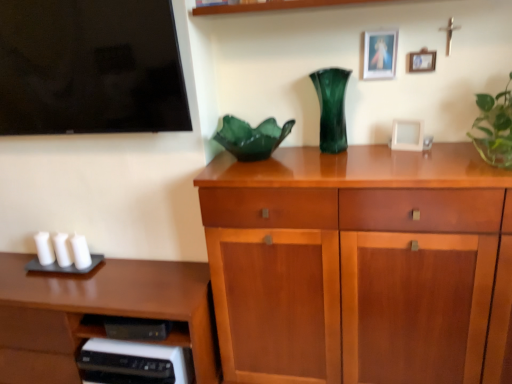
Question: Is matte gold picture frame at upper right, the first picture frame from the top, bigger than wooden cabinet at center?

Choices:
 (A) yes
 (B) no

Answer: (B)

Question: From a real-world perspective, is matte gold picture frame at upper right, the first picture frame from the top, physically above wooden cabinet at center?

Choices:
 (A) no
 (B) yes

Answer: (B)

Question: Is matte gold picture frame at upper right, the 3th picture frame ordered from the bottom, not inside wooden cabinet at center?

Choices:
 (A) no
 (B) yes

Answer: (B)

Question: Is matte gold picture frame at upper right, the first picture frame from the top, positioned with its back to wooden cabinet at center?

Choices:
 (A) yes
 (B) no

Answer: (B)

Question: Is matte gold picture frame at upper right, the first picture frame from the top, smaller than wooden cabinet at center?

Choices:
 (A) yes
 (B) no

Answer: (A)

Question: Is matte white picture frame at upper right, the 2th picture frame positioned from the bottom, bigger or smaller than green glass vase at center?

Choices:
 (A) small
 (B) big

Answer: (A)

Question: Is matte white picture frame at upper right, the 2th picture frame positioned from the bottom, inside or outside of green glass vase at center?

Choices:
 (A) outside
 (B) inside

Answer: (A)

Question: From a real-world perspective, relative to green glass vase at center, is matte white picture frame at upper right, arranged as the 2th picture frame when viewed from the top, vertically above or below?

Choices:
 (A) below
 (B) above

Answer: (B)

Question: Considering the positions of point (417, 59) and point (344, 119), is point (417, 59) closer or farther from the camera than point (344, 119)?

Choices:
 (A) closer
 (B) farther

Answer: (A)

Question: Is white matte candle at lower left, the 3th candle in the right-to-left sequence, in front of or behind wooden cabinet at center in the image?

Choices:
 (A) behind
 (B) front

Answer: (A)

Question: From the image's perspective, is white matte candle at lower left, which appears as the first candle when viewed from the left, positioned above or below wooden cabinet at center?

Choices:
 (A) below
 (B) above

Answer: (B)

Question: In terms of width, does white matte candle at lower left, the 3th candle in the right-to-left sequence, look wider or thinner when compared to wooden cabinet at center?

Choices:
 (A) thin
 (B) wide

Answer: (A)

Question: In terms of size, does white matte candle at lower left, which appears as the first candle when viewed from the left, appear bigger or smaller than wooden cabinet at center?

Choices:
 (A) small
 (B) big

Answer: (A)

Question: Do you think matte gold picture frame at upper right, the first picture frame from the top, is within green glass vase at center, or outside of it?

Choices:
 (A) outside
 (B) inside

Answer: (A)

Question: In terms of height, does matte gold picture frame at upper right, the first picture frame from the top, look taller or shorter compared to green glass vase at center?

Choices:
 (A) tall
 (B) short

Answer: (B)